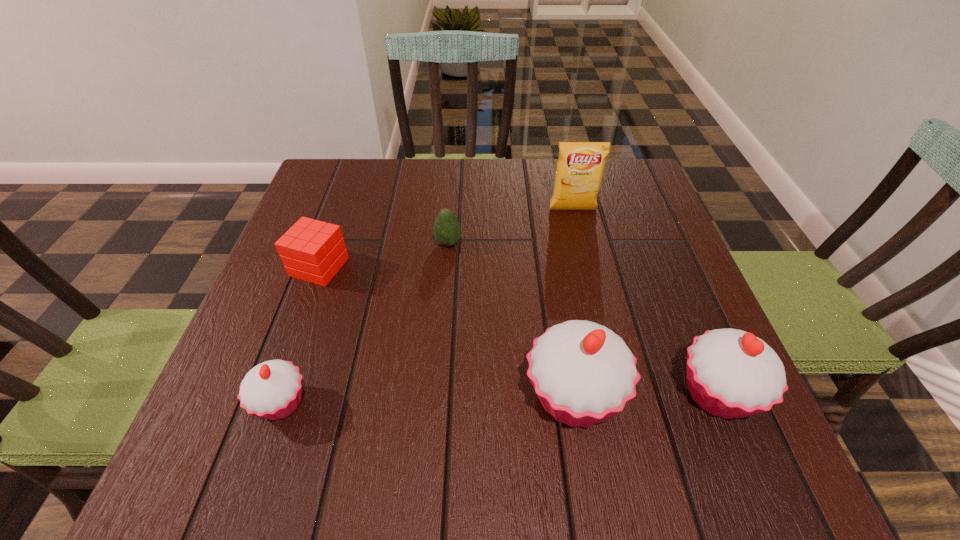
To make them evenly spaced by inserting another cupcake among them, please locate a free space for this new cupcake. Please provide its 2D coordinates. Your answer should be formatted as a tuple, i.e. [(x, y)], where the tuple contains the x and y coordinates of a point satisfying the conditions above.

[(428, 400)]